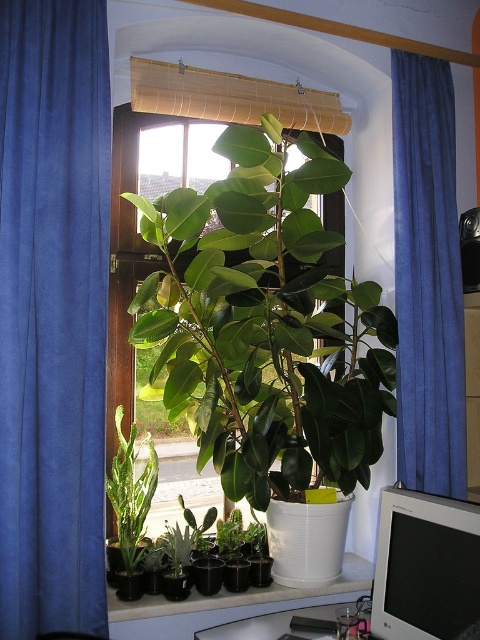
Is blue velvet curtain at left taller than green matte cactus at lower left?

Correct, blue velvet curtain at left is much taller as green matte cactus at lower left.

I want to click on blue velvet curtain at left, so click(x=52, y=314).

Consider the image. Is blue velvet curtain at right below green matte cactus at lower left?

No.

Which is behind, point (432, 172) or point (200, 531)?

The point (432, 172) is more distant.

Which is in front, point (404, 362) or point (194, 541)?

Point (194, 541)

You are a GUI agent. You are given a task and a screenshot of the screen. Output one action in this format:
    pyautogui.click(x=<x>, y=<y>)
    Task: Click on the blue velvet curtain at right
    The width and height of the screenshot is (480, 640).
    Given the screenshot: What is the action you would take?
    pyautogui.click(x=427, y=278)

Between white plastic at center and matte white table at lower right, which one has more height?

Standing taller between the two is matte white table at lower right.

Does point (212, 609) come closer to viewer compared to point (257, 632)?

No, it is behind (257, 632).

Is point (135, 608) farther from camera compared to point (241, 636)?

Yes, it is.

You are a GUI agent. You are given a task and a screenshot of the screen. Output one action in this format:
    pyautogui.click(x=<x>, y=<y>)
    Task: Click on the white plastic at center
    The image size is (480, 640).
    Given the screenshot: What is the action you would take?
    pyautogui.click(x=241, y=595)